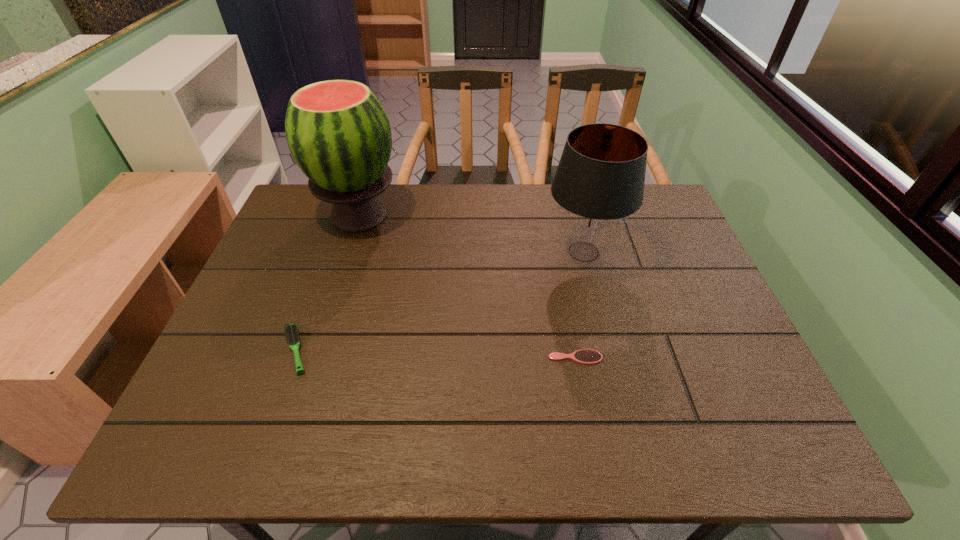
This screenshot has height=540, width=960. Identify the location of watermelon located in the far edge section of the desktop. (338, 132).

Find the location of a particular element. The width and height of the screenshot is (960, 540). lampshade that is at the far edge is located at coordinates (599, 182).

Locate an element on the screen. Image resolution: width=960 pixels, height=540 pixels. watermelon positioned at the left edge is located at coordinates (338, 132).

This screenshot has height=540, width=960. Identify the location of hairbrush positioned at the left edge. (291, 330).

The height and width of the screenshot is (540, 960). I want to click on object situated at the far left corner, so click(338, 132).

The height and width of the screenshot is (540, 960). I want to click on free location at the far edge of the desktop, so click(x=540, y=191).

In the image, there is a desktop. Where is `free space at the near edge`? Image resolution: width=960 pixels, height=540 pixels. free space at the near edge is located at coordinates (331, 446).

Identify the location of free space at the right edge of the desktop. (735, 339).

At what (x,y) coordinates should I click in order to perform the action: click on vacant space at the far left corner. Please return your answer as a coordinate pair (x, y). Looking at the image, I should click on (291, 212).

I want to click on vacant space at the near left corner of the desktop, so click(x=238, y=451).